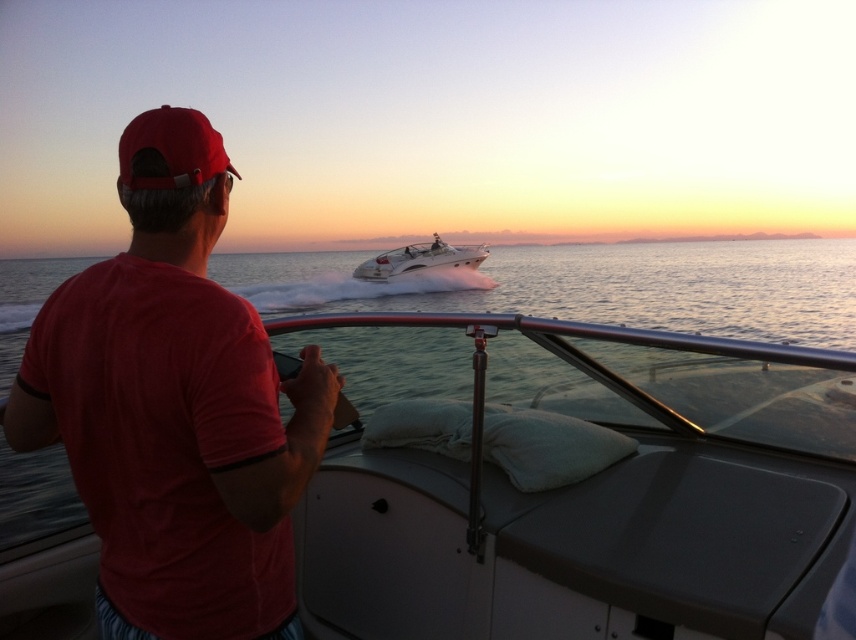
Question: Which object is positioned closest to the matte red baseball cap at upper left?

Choices:
 (A) white glossy speedboat at center
 (B) clear water at center
 (C) matte red t-shirt at left

Answer: (C)

Question: Can you confirm if matte red baseball cap at upper left is wider than white glossy speedboat at center?

Choices:
 (A) no
 (B) yes

Answer: (A)

Question: Considering the real-world distances, which object is closest to the matte red baseball cap at upper left?

Choices:
 (A) clear water at center
 (B) matte red t-shirt at left
 (C) white glossy speedboat at center

Answer: (B)

Question: Considering the relative positions of matte red t-shirt at left and white glossy speedboat at center in the image provided, where is matte red t-shirt at left located with respect to white glossy speedboat at center?

Choices:
 (A) right
 (B) left

Answer: (A)

Question: Which point is farther from the camera taking this photo?

Choices:
 (A) (122, 154)
 (B) (453, 364)

Answer: (B)

Question: Is clear water at center further to camera compared to white glossy speedboat at center?

Choices:
 (A) no
 (B) yes

Answer: (A)